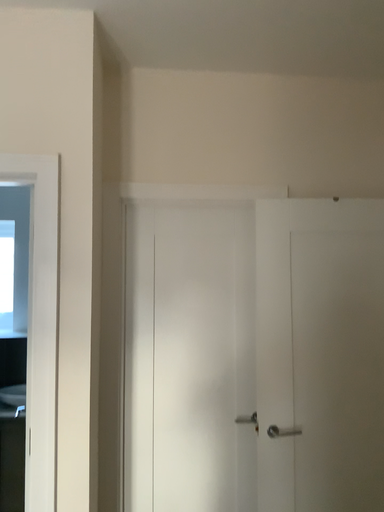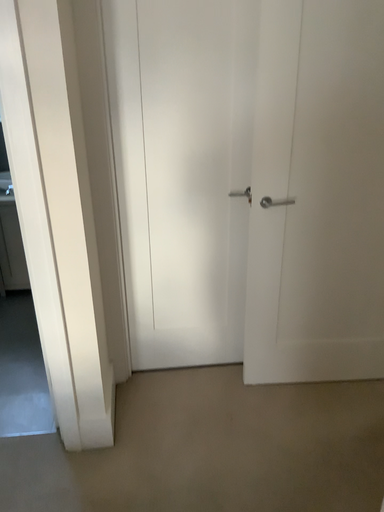
Question: Which way did the camera rotate in the video?

Choices:
 (A) rotated upward
 (B) rotated downward

Answer: (B)